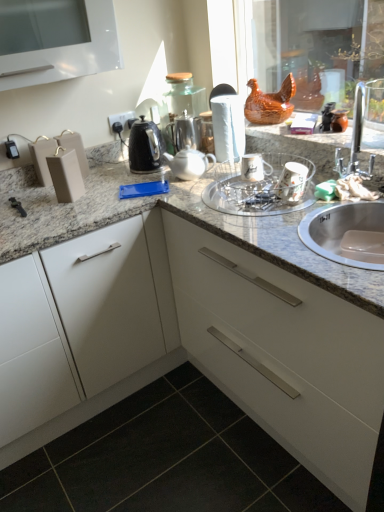
Question: Should I look upward or downward to see silver metallic sink at right?

Choices:
 (A) up
 (B) down

Answer: (A)

Question: Does white matte paper towel at center touch brown glossy chicken at upper center?

Choices:
 (A) yes
 (B) no

Answer: (B)

Question: From a real-world perspective, is white matte paper towel at center physically above brown glossy chicken at upper center?

Choices:
 (A) yes
 (B) no

Answer: (B)

Question: Is white matte paper towel at center positioned in front of brown glossy chicken at upper center?

Choices:
 (A) no
 (B) yes

Answer: (A)

Question: Considering the relative positions of white matte paper towel at center and brown glossy chicken at upper center in the image provided, is white matte paper towel at center to the right of brown glossy chicken at upper center from the viewer's perspective?

Choices:
 (A) no
 (B) yes

Answer: (A)

Question: Can we say white matte paper towel at center lies outside brown glossy chicken at upper center?

Choices:
 (A) no
 (B) yes

Answer: (B)

Question: From the image's perspective, is white matte paper towel at center located beneath brown glossy chicken at upper center?

Choices:
 (A) yes
 (B) no

Answer: (A)

Question: Does white glossy tea pot at center, acting as the 2th tea pot starting from the back, have a greater height compared to satin silver teapot at center, which is the 1th tea pot in back-to-front order?

Choices:
 (A) yes
 (B) no

Answer: (B)

Question: Is white glossy tea pot at center, acting as the 2th tea pot starting from the back, beside satin silver teapot at center, which is the 1th tea pot in back-to-front order?

Choices:
 (A) no
 (B) yes

Answer: (A)

Question: Can you confirm if white glossy tea pot at center, which is the first tea pot in front-to-back order, is shorter than satin silver teapot at center, positioned as the second tea pot in front-to-back order?

Choices:
 (A) no
 (B) yes

Answer: (B)

Question: Can you confirm if white glossy tea pot at center, which is the first tea pot in front-to-back order, is smaller than satin silver teapot at center, which is the 1th tea pot in back-to-front order?

Choices:
 (A) no
 (B) yes

Answer: (B)

Question: Is white glossy tea pot at center, acting as the 2th tea pot starting from the back, closer to the viewer compared to satin silver teapot at center, positioned as the second tea pot in front-to-back order?

Choices:
 (A) yes
 (B) no

Answer: (A)

Question: Considering the relative sizes of white glossy tea pot at center, acting as the 2th tea pot starting from the back, and satin silver teapot at center, positioned as the second tea pot in front-to-back order, in the image provided, is white glossy tea pot at center, acting as the 2th tea pot starting from the back, thinner than satin silver teapot at center, positioned as the second tea pot in front-to-back order,?

Choices:
 (A) yes
 (B) no

Answer: (B)

Question: Could you tell me if granite at center is facing black tile at lower left?

Choices:
 (A) no
 (B) yes

Answer: (A)